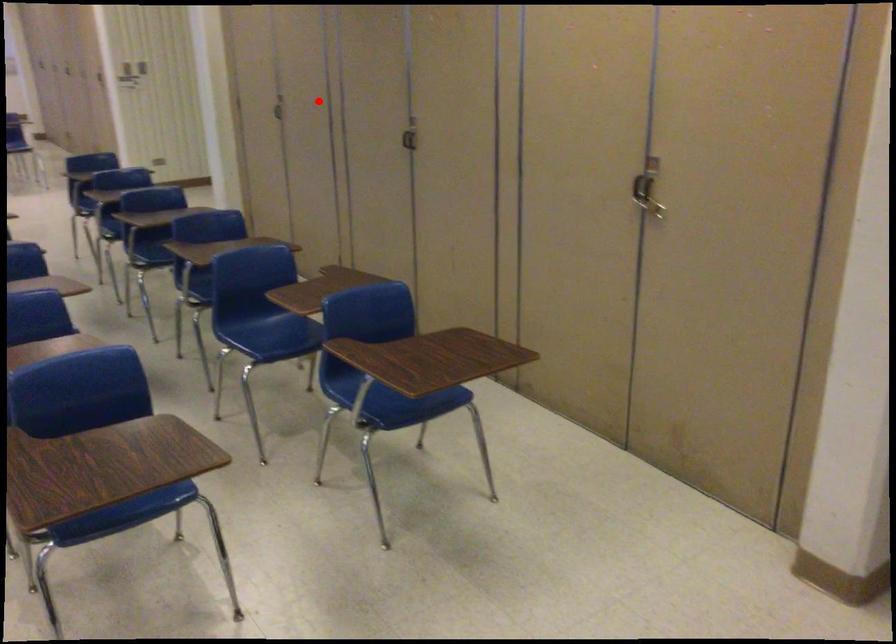
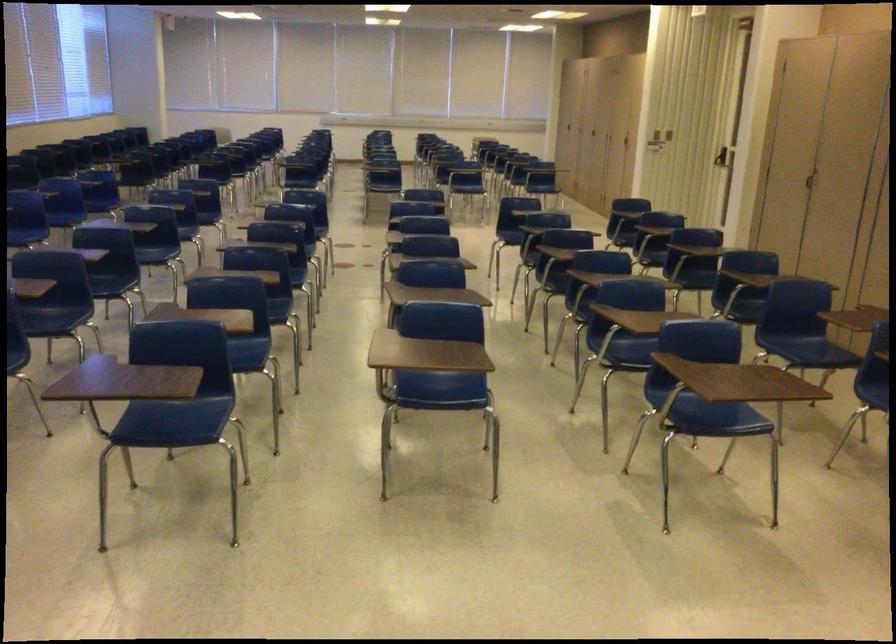
Find the pixel in the second image that matches the highlighted location in the first image.

(853, 173)